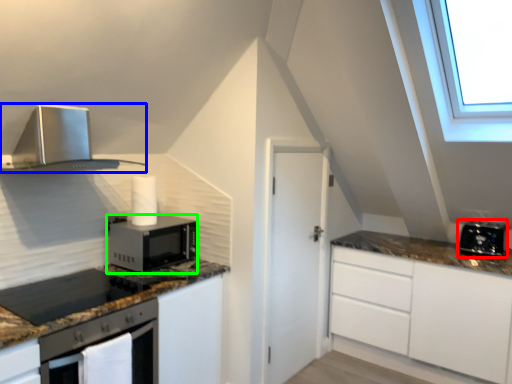
Question: Considering the real-world distances, which object is closest to toaster (highlighted by a red box)? home appliance (highlighted by a blue box) or microwave oven (highlighted by a green box).

Choices:
 (A) home appliance
 (B) microwave oven

Answer: (B)